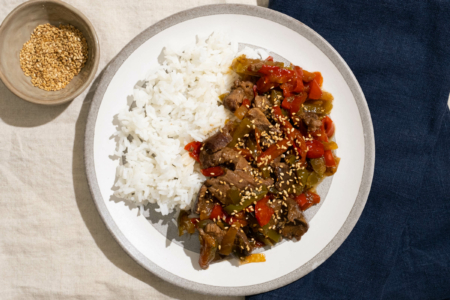
At what (x,y) coordinates should I click in order to perform the action: click on table. Please return your answer as a coordinate pair (x, y). This screenshot has width=450, height=300. Looking at the image, I should click on (55, 261).